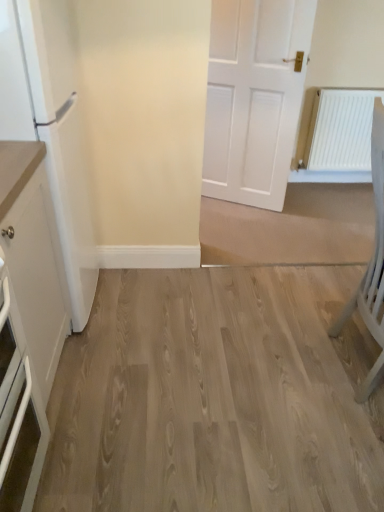
Question: Does white glossy refrigerator at left have a smaller size compared to light gray wooden chair at right?

Choices:
 (A) no
 (B) yes

Answer: (A)

Question: Considering the relative sizes of white glossy refrigerator at left and light gray wooden chair at right in the image provided, is white glossy refrigerator at left shorter than light gray wooden chair at right?

Choices:
 (A) yes
 (B) no

Answer: (B)

Question: Does white glossy refrigerator at left appear on the right side of light gray wooden chair at right?

Choices:
 (A) yes
 (B) no

Answer: (B)

Question: From the image's perspective, is white glossy refrigerator at left on top of light gray wooden chair at right?

Choices:
 (A) yes
 (B) no

Answer: (A)

Question: Is light gray wooden chair at right inside white glossy refrigerator at left?

Choices:
 (A) yes
 (B) no

Answer: (B)

Question: Does white glossy refrigerator at left touch light gray wooden chair at right?

Choices:
 (A) yes
 (B) no

Answer: (B)

Question: Can you confirm if white glossy refrigerator at left is positioned to the left of white matte cabinet at left?

Choices:
 (A) no
 (B) yes

Answer: (B)

Question: Is white glossy refrigerator at left facing away from white matte cabinet at left?

Choices:
 (A) yes
 (B) no

Answer: (B)

Question: Is white glossy refrigerator at left closer to camera compared to white matte cabinet at left?

Choices:
 (A) yes
 (B) no

Answer: (B)

Question: Can you confirm if white glossy refrigerator at left is shorter than white matte cabinet at left?

Choices:
 (A) yes
 (B) no

Answer: (B)

Question: From the image's perspective, is white glossy refrigerator at left beneath white matte cabinet at left?

Choices:
 (A) yes
 (B) no

Answer: (B)

Question: Considering the relative sizes of white glossy refrigerator at left and white matte cabinet at left in the image provided, is white glossy refrigerator at left smaller than white matte cabinet at left?

Choices:
 (A) no
 (B) yes

Answer: (A)

Question: Does white glossy refrigerator at left have a larger size compared to light wood flooring at center?

Choices:
 (A) yes
 (B) no

Answer: (B)